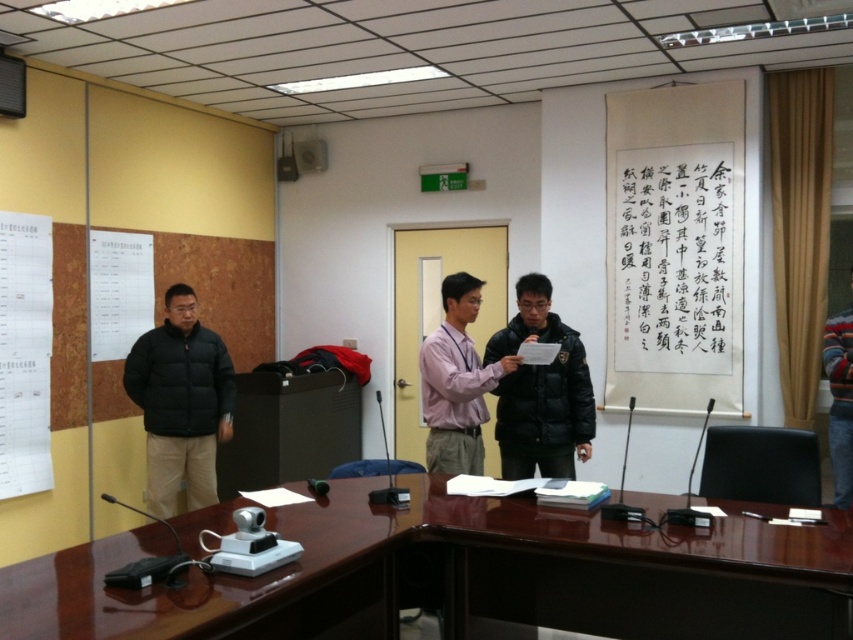
Looking at this image, you are organizing a meeting in the conference room and need to place a 1.2 meter wide laptop stand on the brown polished wood table at center. Considering the pink matte shirt at center is currently occupying space on the table, can the laptop stand fit on the table?

The brown polished wood table at center is wider than the pink matte shirt at center, so there is enough space to place the 1.2 meter wide laptop stand on the table after adjusting the position of the pink matte shirt at center.